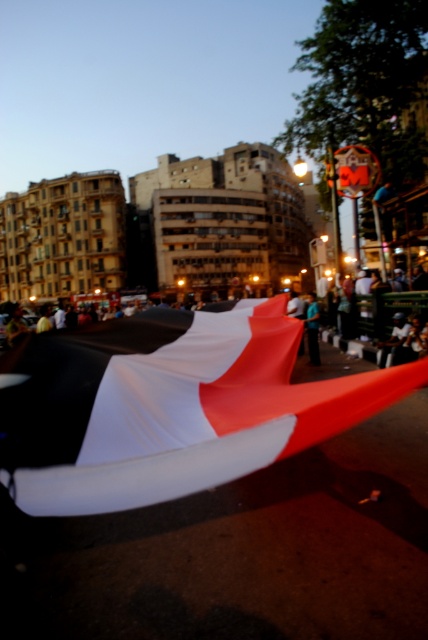
Locate an element on the screen. Image resolution: width=428 pixels, height=640 pixels. white matte flag at center is located at coordinates (172, 406).

Can you confirm if white matte flag at center is bigger than blue fabric at center?

Actually, white matte flag at center might be smaller than blue fabric at center.

Locate an element on the screen. The width and height of the screenshot is (428, 640). white matte flag at center is located at coordinates pyautogui.click(x=172, y=406).